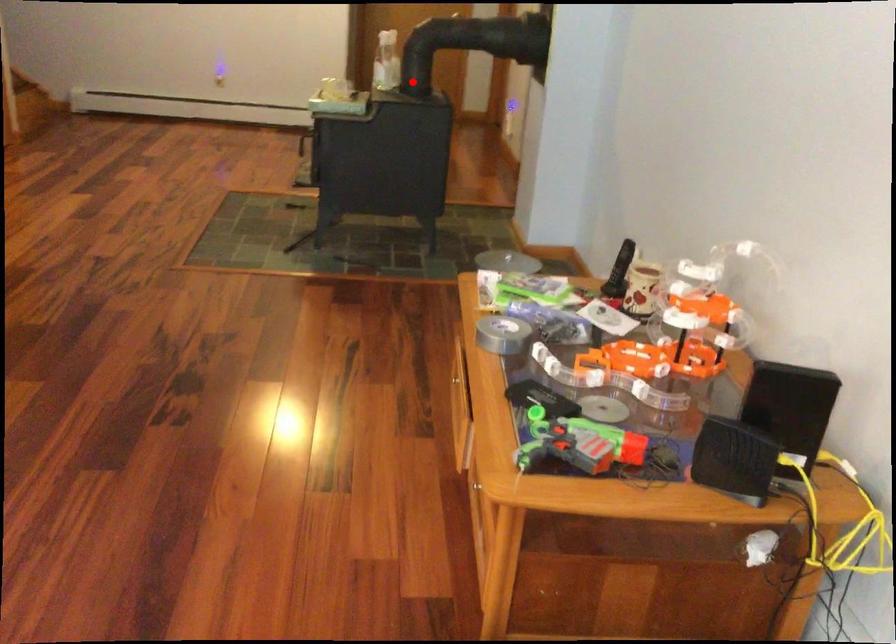
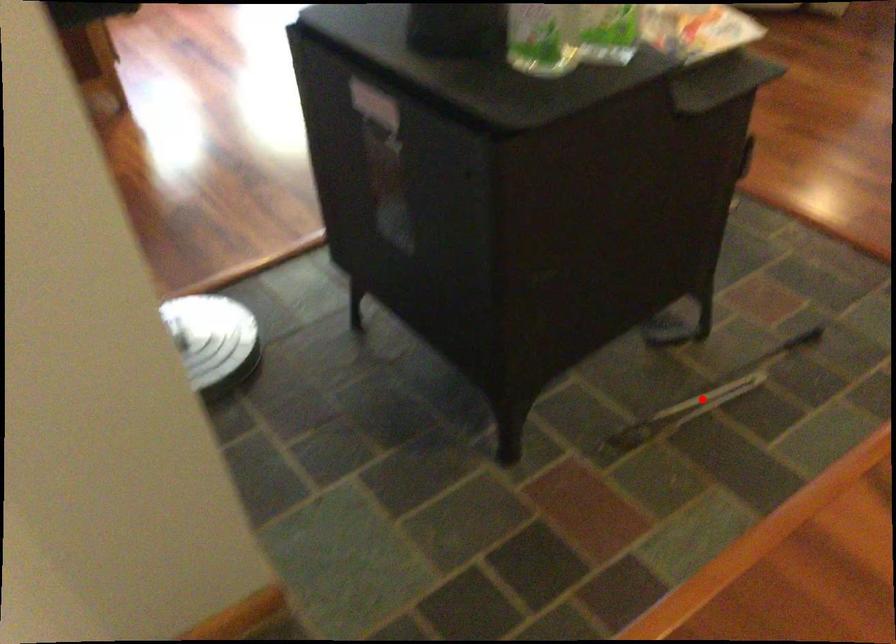
I am providing you with two images of the same scene from different viewpoints. A red point is marked on the first image and another point is marked on the second image. Is the red point in image1 aligned with the point shown in image2?

No